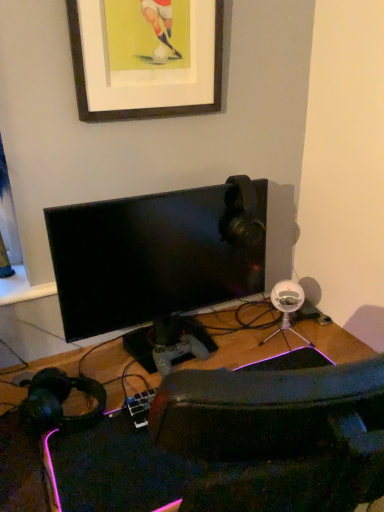
The image size is (384, 512). I want to click on free space to the back side of black matte headphones at lower left, so click(86, 364).